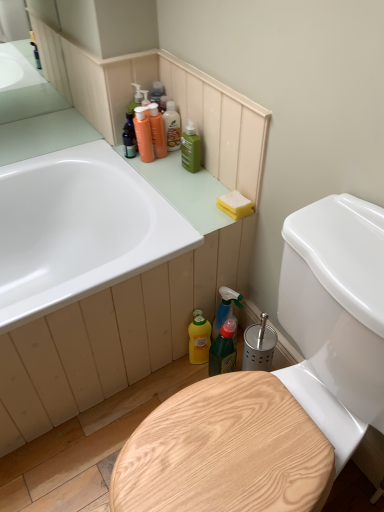
Identify the location of free space in front of green matte bottle at upper center, which is the third cleaning product from bottom to top. This screenshot has height=512, width=384. (189, 189).